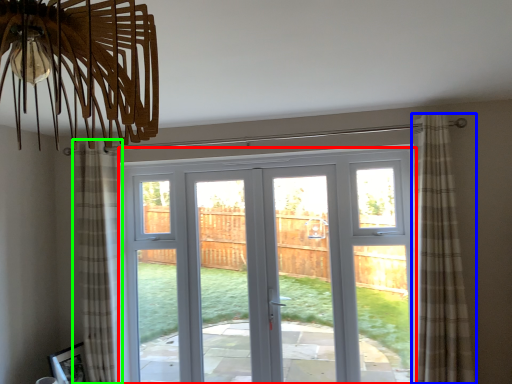
Question: Which object is positioned farthest from door (highlighted by a red box)? Select from curtain (highlighted by a blue box) and curtain (highlighted by a green box).

Choices:
 (A) curtain
 (B) curtain

Answer: (B)